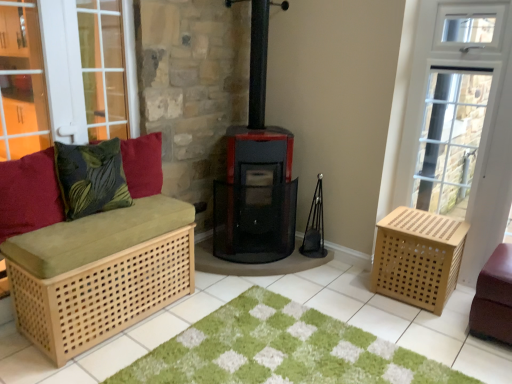
Image resolution: width=512 pixels, height=384 pixels. What do you see at coordinates (461, 122) in the screenshot?
I see `wooden crate at right` at bounding box center [461, 122].

Find the location of a particular element. The image size is (512, 384). wooden crate at right is located at coordinates (461, 122).

At what (x,y) coordinates should I click in order to perform the action: click on velvet red cushion at left, which is counted as the 1th pillow, starting from the left. Please return your answer as a coordinate pair (x, y). This screenshot has width=512, height=384. Looking at the image, I should click on (29, 194).

What do you see at coordinates (418, 257) in the screenshot?
I see `natural wood crate at right` at bounding box center [418, 257].

Identify the location of leather ottoman at lower right, the 1th furniture when ordered from right to left. (494, 297).

What do you see at coordinates (143, 164) in the screenshot?
I see `velvety green pillow at left, the third pillow from the left` at bounding box center [143, 164].

What is the approximate height of natural wood bench at left, the 2th furniture when ordered from right to left?

24.62 inches.

This screenshot has width=512, height=384. Describe the element at coordinates (103, 263) in the screenshot. I see `natural wood bench at left, the 2th furniture when ordered from right to left` at that location.

Find the location of `wooden crate at right`. wooden crate at right is located at coordinates pos(461,122).

Which object is further away from the camera taking this photo, wooden crate at right or green shaggy rug at center?

wooden crate at right.

From a real-world perspective, is wooden crate at right located higher than green shaggy rug at center?

Yes, from a real-world perspective, wooden crate at right is over green shaggy rug at center

Is wooden crate at right bigger than green shaggy rug at center?

Indeed, wooden crate at right has a larger size compared to green shaggy rug at center.

Who is bigger, natural wood bench at left, the 2th furniture when ordered from right to left, or green leafy fabric pillow at left, which is the 2th pillow from left to right?

With larger size is natural wood bench at left, the 2th furniture when ordered from right to left.

Is natural wood bench at left, the 2th furniture when ordered from right to left, to the left of green leafy fabric pillow at left, which is the 2th pillow from left to right, from the viewer's perspective?

Incorrect, natural wood bench at left, the 2th furniture when ordered from right to left, is not on the left side of green leafy fabric pillow at left, which is the 2th pillow from left to right.

Could you measure the distance between natural wood bench at left, the 2th furniture when ordered from right to left, and green leafy fabric pillow at left, placed as the 2th pillow when sorted from right to left?

natural wood bench at left, the 2th furniture when ordered from right to left, and green leafy fabric pillow at left, placed as the 2th pillow when sorted from right to left, are 11.19 inches apart from each other.

Is natural wood bench at left, the 2th furniture when ordered from right to left, far away from green leafy fabric pillow at left, which is the 2th pillow from left to right?

They are positioned close to each other.

Is green leafy fabric pillow at left, placed as the 2th pillow when sorted from right to left, behind velvety green pillow at left, the third pillow from the left?

That is False.

Can you confirm if green leafy fabric pillow at left, which is the 2th pillow from left to right, is smaller than velvety green pillow at left, marked as the 1th pillow in a right-to-left arrangement?

No.

Is green leafy fabric pillow at left, placed as the 2th pillow when sorted from right to left, taller or shorter than velvety green pillow at left, the third pillow from the left?

Clearly, green leafy fabric pillow at left, placed as the 2th pillow when sorted from right to left, is taller compared to velvety green pillow at left, the third pillow from the left.

Can you confirm if leather ottoman at lower right, marked as the second furniture in a left-to-right arrangement, is wider than velvet red cushion at left, arranged as the 3th pillow when viewed from the right?

Yes, leather ottoman at lower right, marked as the second furniture in a left-to-right arrangement, is wider than velvet red cushion at left, arranged as the 3th pillow when viewed from the right.

Who is smaller, leather ottoman at lower right, marked as the second furniture in a left-to-right arrangement, or velvet red cushion at left, which is counted as the 1th pillow, starting from the left?

Smaller between the two is velvet red cushion at left, which is counted as the 1th pillow, starting from the left.

Looking at this image, is velvet red cushion at left, arranged as the 3th pillow when viewed from the right, a part of leather ottoman at lower right, marked as the second furniture in a left-to-right arrangement?

No, velvet red cushion at left, arranged as the 3th pillow when viewed from the right, is located outside of leather ottoman at lower right, marked as the second furniture in a left-to-right arrangement.

Considering the sizes of objects leather ottoman at lower right, the 1th furniture when ordered from right to left, and velvet red cushion at left, arranged as the 3th pillow when viewed from the right, in the image provided, who is shorter, leather ottoman at lower right, the 1th furniture when ordered from right to left, or velvet red cushion at left, arranged as the 3th pillow when viewed from the right,?

Standing shorter between the two is velvet red cushion at left, arranged as the 3th pillow when viewed from the right.

Are green leafy fabric pillow at left, placed as the 2th pillow when sorted from right to left, and velvet red cushion at left, arranged as the 3th pillow when viewed from the right, located far from each other?

They are positioned close to each other.

Is green leafy fabric pillow at left, which is the 2th pillow from left to right, to the right of velvet red cushion at left, arranged as the 3th pillow when viewed from the right, from the viewer's perspective?

Correct, you'll find green leafy fabric pillow at left, which is the 2th pillow from left to right, to the right of velvet red cushion at left, arranged as the 3th pillow when viewed from the right.

Does green leafy fabric pillow at left, placed as the 2th pillow when sorted from right to left, have a larger size compared to velvet red cushion at left, which is counted as the 1th pillow, starting from the left?

Indeed, green leafy fabric pillow at left, placed as the 2th pillow when sorted from right to left, has a larger size compared to velvet red cushion at left, which is counted as the 1th pillow, starting from the left.

Who is taller, green leafy fabric pillow at left, placed as the 2th pillow when sorted from right to left, or velvet red cushion at left, arranged as the 3th pillow when viewed from the right?

With more height is velvet red cushion at left, arranged as the 3th pillow when viewed from the right.

From the image's perspective, is wooden crate at right above velvet red cushion at left, arranged as the 3th pillow when viewed from the right?

Yes.

Considering the sizes of wooden crate at right and velvet red cushion at left, which is counted as the 1th pillow, starting from the left, in the image, is wooden crate at right wider or thinner than velvet red cushion at left, which is counted as the 1th pillow, starting from the left,?

wooden crate at right is thinner than velvet red cushion at left, which is counted as the 1th pillow, starting from the left.

Consider the image. Is wooden crate at right next to velvet red cushion at left, which is counted as the 1th pillow, starting from the left?

No, wooden crate at right is not touching velvet red cushion at left, which is counted as the 1th pillow, starting from the left.

From the image's perspective, which is below, leather ottoman at lower right, the 1th furniture when ordered from right to left, or natural wood bench at left, which ranks as the first furniture in left-to-right order?

leather ottoman at lower right, the 1th furniture when ordered from right to left.

Can you confirm if leather ottoman at lower right, marked as the second furniture in a left-to-right arrangement, is taller than natural wood bench at left, which ranks as the first furniture in left-to-right order?

In fact, leather ottoman at lower right, marked as the second furniture in a left-to-right arrangement, may be shorter than natural wood bench at left, which ranks as the first furniture in left-to-right order.

Is leather ottoman at lower right, the 1th furniture when ordered from right to left, far away from natural wood bench at left, the 2th furniture when ordered from right to left?

Yes, leather ottoman at lower right, the 1th furniture when ordered from right to left, and natural wood bench at left, the 2th furniture when ordered from right to left, are located far from each other.

How far apart are leather ottoman at lower right, the 1th furniture when ordered from right to left, and natural wood bench at left, the 2th furniture when ordered from right to left?

leather ottoman at lower right, the 1th furniture when ordered from right to left, is 6.72 feet away from natural wood bench at left, the 2th furniture when ordered from right to left.

Locate an element on the screen. The image size is (512, 384). doormat that is below the wooden crate at right (from the image's perspective) is located at coordinates (280, 350).

Starting from the green leafy fabric pillow at left, which is the 2th pillow from left to right, which furniture is the 1st one to the right? Please provide its 2D coordinates.

[(103, 263)]

Estimate the real-world distances between objects in this image. Which object is closer to natural wood crate at right, velvety green pillow at left, the third pillow from the left, or wooden crate at right?

The object closer to natural wood crate at right is wooden crate at right.

Which object lies further to the anchor point green shaggy rug at center, natural wood bench at left, the 2th furniture when ordered from right to left, or velvet red cushion at left, which is counted as the 1th pillow, starting from the left?

velvet red cushion at left, which is counted as the 1th pillow, starting from the left.

In the scene shown: Based on their spatial positions, is natural wood bench at left, which ranks as the first furniture in left-to-right order, or natural wood crate at right closer to green leafy fabric pillow at left, which is the 2th pillow from left to right?

natural wood bench at left, which ranks as the first furniture in left-to-right order, is closer to green leafy fabric pillow at left, which is the 2th pillow from left to right.

From the picture: Based on their spatial positions, is velvety green pillow at left, marked as the 1th pillow in a right-to-left arrangement, or green leafy fabric pillow at left, which is the 2th pillow from left to right, closer to velvet red cushion at left, which is counted as the 1th pillow, starting from the left?

green leafy fabric pillow at left, which is the 2th pillow from left to right.

Considering their positions, is wooden crate at right positioned further to green leafy fabric pillow at left, which is the 2th pillow from left to right, than natural wood crate at right?

wooden crate at right lies further to green leafy fabric pillow at left, which is the 2th pillow from left to right, than the other object.

When comparing their distances from natural wood bench at left, which ranks as the first furniture in left-to-right order, does natural wood crate at right or green shaggy rug at center seem closer?

green shaggy rug at center is positioned closer to the anchor natural wood bench at left, which ranks as the first furniture in left-to-right order.

When comparing their distances from leather ottoman at lower right, marked as the second furniture in a left-to-right arrangement, does wooden crate at right or natural wood crate at right seem closer?

Among the two, natural wood crate at right is located nearer to leather ottoman at lower right, marked as the second furniture in a left-to-right arrangement.

Which object lies further to the anchor point velvety green pillow at left, marked as the 1th pillow in a right-to-left arrangement, velvet red cushion at left, which is counted as the 1th pillow, starting from the left, or green shaggy rug at center?

The object further to velvety green pillow at left, marked as the 1th pillow in a right-to-left arrangement, is green shaggy rug at center.

This screenshot has width=512, height=384. What are the coordinates of `doormat between green leafy fabric pillow at left, placed as the 2th pillow when sorted from right to left, and natural wood crate at right` in the screenshot? It's located at (280, 350).

Find the location of a particular element. Image resolution: width=512 pixels, height=384 pixels. crate between velvet red cushion at left, arranged as the 3th pillow when viewed from the right, and wooden crate at right, in the horizontal direction is located at coordinates (418, 257).

The image size is (512, 384). Identify the location of doormat between velvet red cushion at left, which is counted as the 1th pillow, starting from the left, and wooden crate at right from left to right. (280, 350).

Where is `screen door between natural wood bench at left, which ranks as the first furniture in left-to-right order, and leather ottoman at lower right, marked as the second furniture in a left-to-right arrangement`? screen door between natural wood bench at left, which ranks as the first furniture in left-to-right order, and leather ottoman at lower right, marked as the second furniture in a left-to-right arrangement is located at coordinates (461, 122).